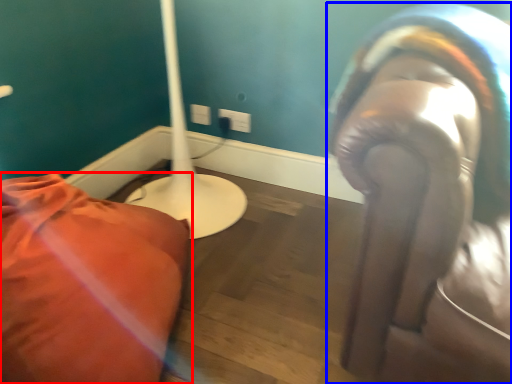
Question: Which point is closer to the camera, furniture (highlighted by a red box) or person (highlighted by a blue box)?

Choices:
 (A) furniture
 (B) person

Answer: (A)